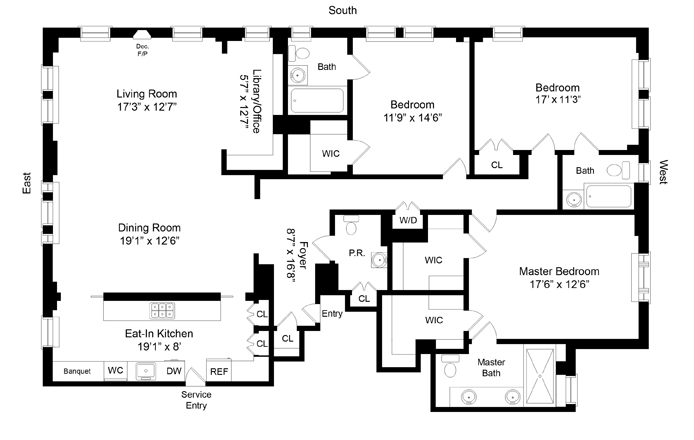
Identify the location of bath. (600, 190).